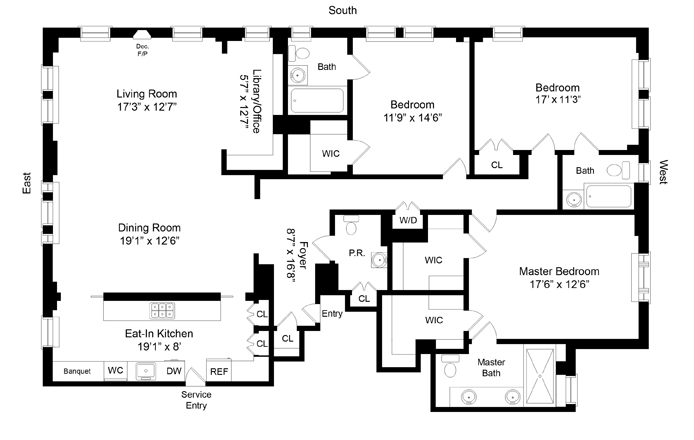
Identify the location of bath. (600, 190).